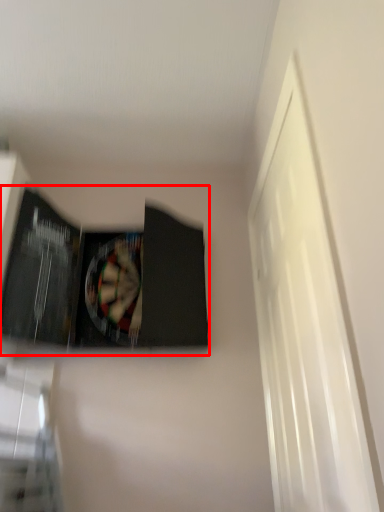
Question: From the image's perspective, what is the correct spatial relationship of paperback book (annotated by the red box) in relation to window?

Choices:
 (A) below
 (B) above

Answer: (B)